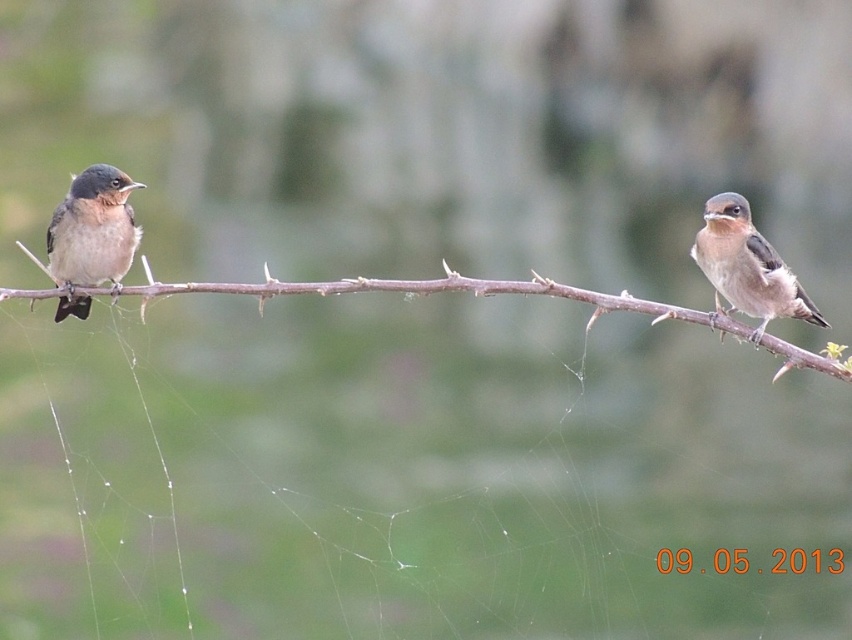
Question: Which is farther from the brown matte bird at right?

Choices:
 (A) brown matte bird at left
 (B) brown textured branch at center

Answer: (A)

Question: Does brown textured branch at center have a greater width compared to brown matte bird at right?

Choices:
 (A) yes
 (B) no

Answer: (A)

Question: In this image, where is brown textured branch at center located relative to brown matte bird at right?

Choices:
 (A) below
 (B) above

Answer: (B)

Question: Which object is positioned closest to the brown textured branch at center?

Choices:
 (A) brown matte bird at right
 (B) brown matte bird at left

Answer: (B)

Question: Considering the real-world distances, which object is farthest from the brown textured branch at center?

Choices:
 (A) brown matte bird at left
 (B) brown matte bird at right

Answer: (B)

Question: Is brown textured branch at center bigger than brown matte bird at left?

Choices:
 (A) yes
 (B) no

Answer: (A)